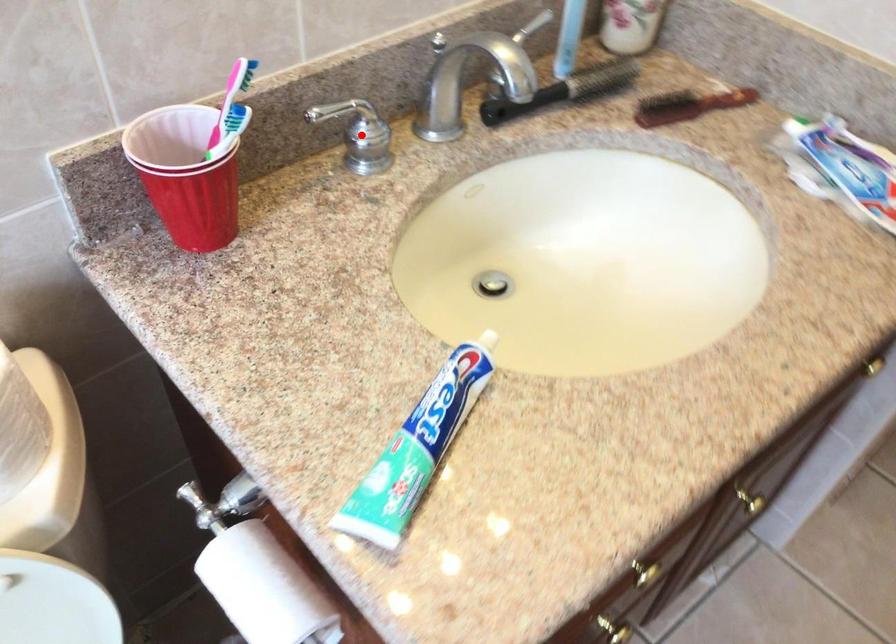
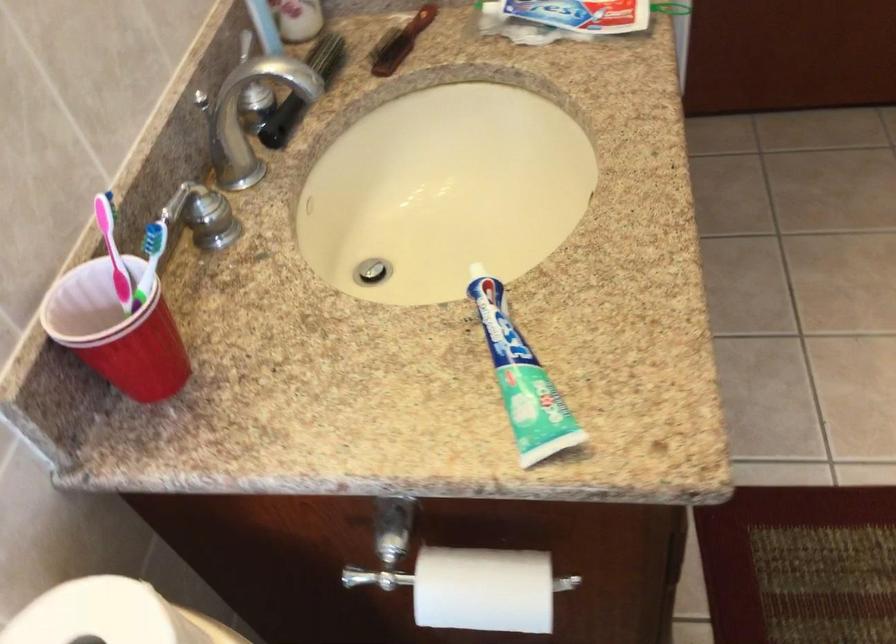
Where in the second image is the point corresponding to the highlighted location from the first image?

(207, 212)